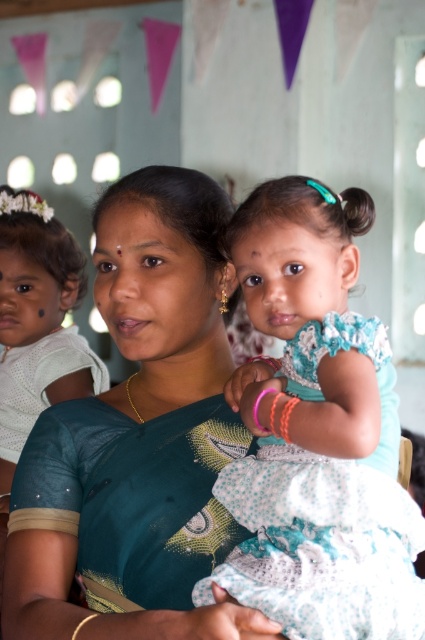
Question: Which of the following is the farthest from the observer?

Choices:
 (A) light blue fabric dress at center
 (B) teal silk saree at center
 (C) white fabric at left

Answer: (C)

Question: Which object is the closest to the light blue fabric dress at center?

Choices:
 (A) teal silk saree at center
 (B) white fabric at left

Answer: (A)

Question: Does teal silk saree at center appear under white fabric at left?

Choices:
 (A) no
 (B) yes

Answer: (B)

Question: Is teal silk saree at center above white fabric at left?

Choices:
 (A) no
 (B) yes

Answer: (A)

Question: Which is farther from the light blue fabric dress at center?

Choices:
 (A) white fabric at left
 (B) teal silk saree at center

Answer: (A)

Question: Does teal silk saree at center appear on the left side of white fabric at left?

Choices:
 (A) yes
 (B) no

Answer: (B)